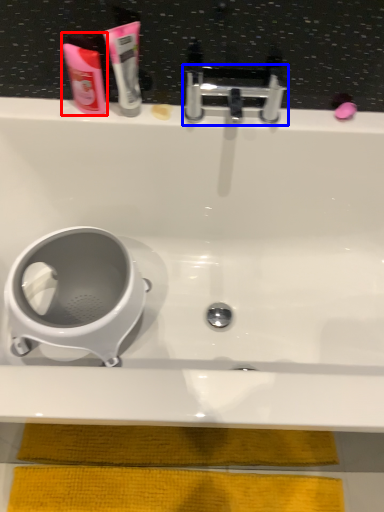
Question: Which object appears farthest to the camera in this image, mouthwash (highlighted by a red box) or tap (highlighted by a blue box)?

Choices:
 (A) mouthwash
 (B) tap

Answer: (B)